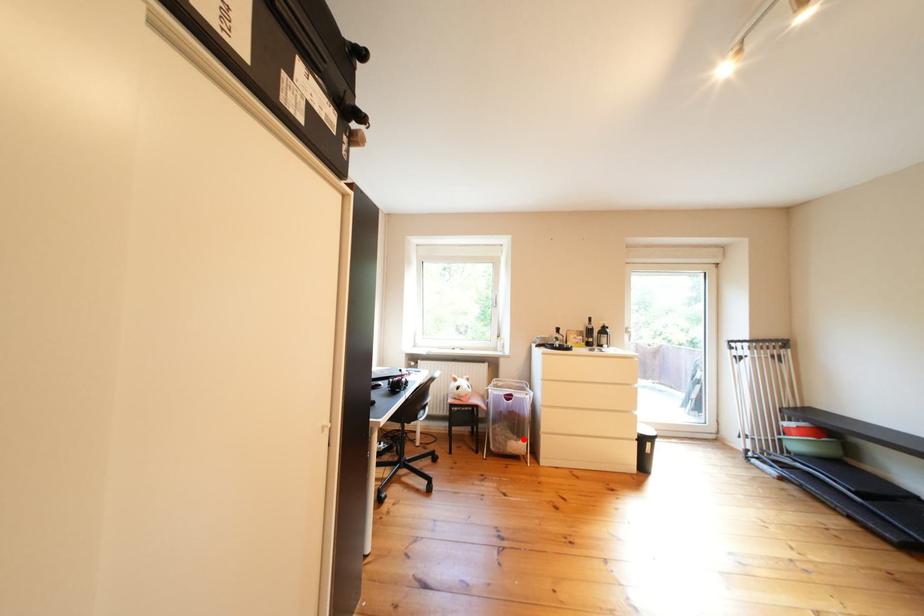
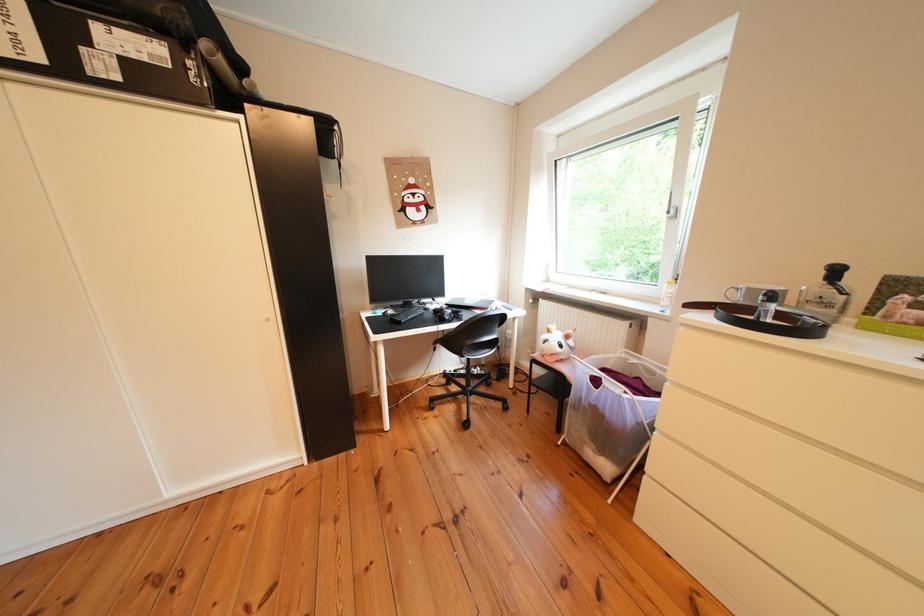
Question: I am providing you with two images of the same scene from different viewpoints. In image1, a red point is highlighted. Considering the same 3D point in image2, which of the following is correct?

Choices:
 (A) It is closer
 (B) It is farther

Answer: (A)